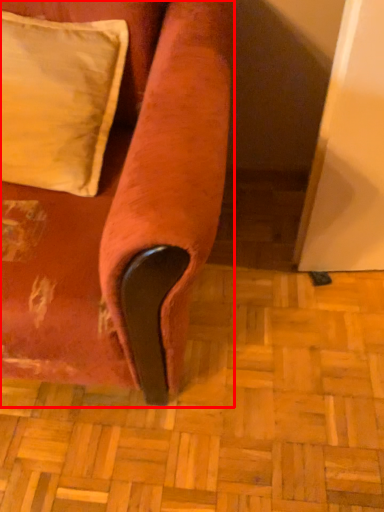
Question: Observing the image, what is the correct spatial positioning of furniture (annotated by the red box) in reference to pillow?

Choices:
 (A) left
 (B) right

Answer: (A)